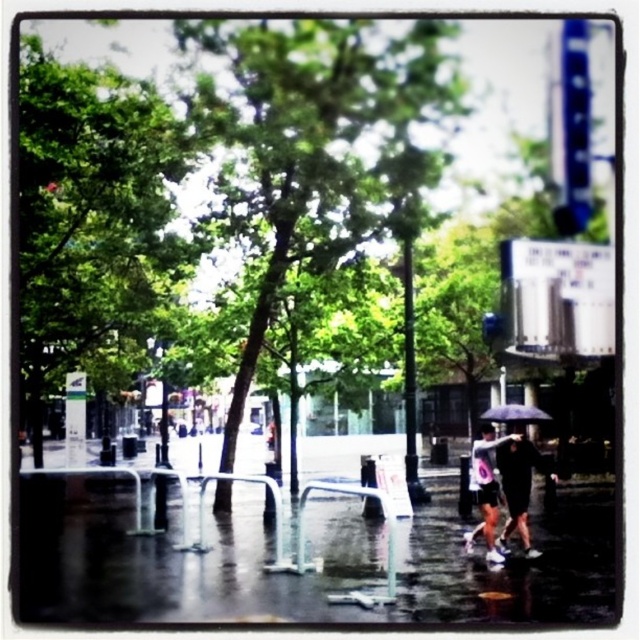
You are a pedestrian trying to find shelter from the rain. You see a dark gray fabric umbrella at lower right and a white matte umbrella at lower right. Which one is shorter and might be easier to carry under the trees?

The dark gray fabric umbrella at lower right is not as tall as the white matte umbrella at lower right, so it might be easier to carry under the trees because it is shorter.